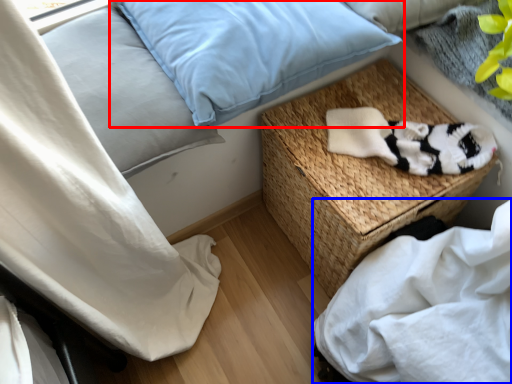
Question: Among these objects, which one is nearest to the camera, pillow (highlighted by a red box) or sheet (highlighted by a blue box)?

Choices:
 (A) pillow
 (B) sheet

Answer: (B)